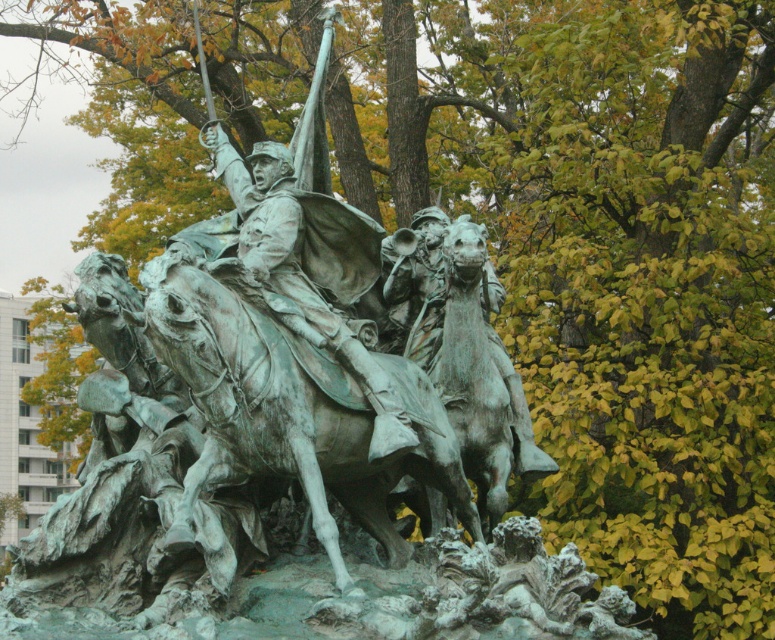
What do you see at coordinates (288, 413) in the screenshot? I see `green patina horse at center` at bounding box center [288, 413].

Locate an element on the screen. This screenshot has width=775, height=640. green patina horse at center is located at coordinates (288, 413).